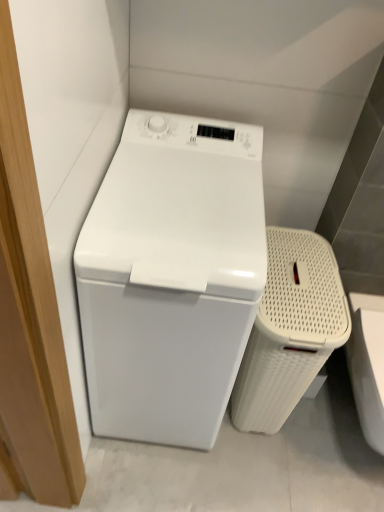
Where is `vacant space situated above white woven laundry basket at right (from a real-world perspective)`? The height and width of the screenshot is (512, 384). vacant space situated above white woven laundry basket at right (from a real-world perspective) is located at coordinates (303, 287).